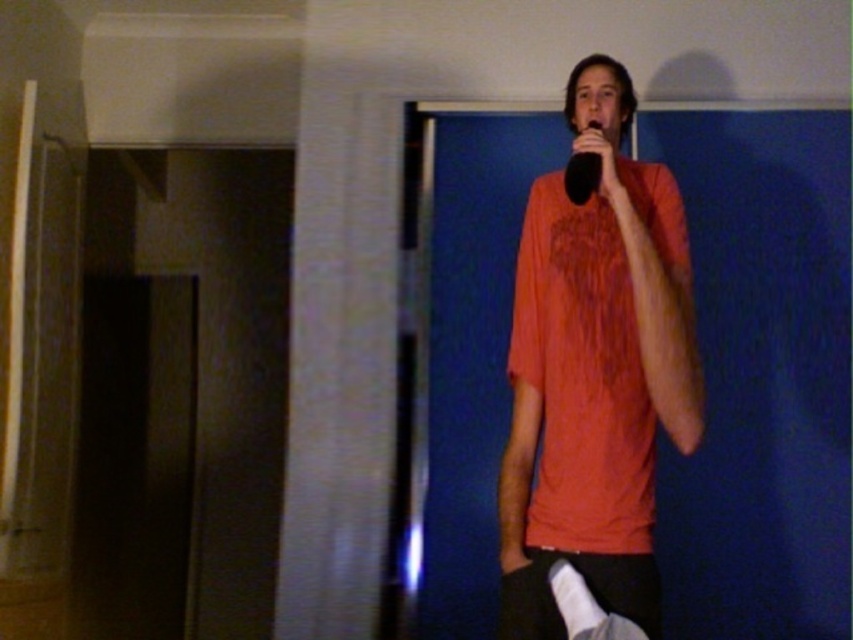
Can you confirm if orange cotton shirt at center is taller than black matte microphone at upper center?

Yes.

Identify the location of orange cotton shirt at center. The image size is (853, 640). (595, 372).